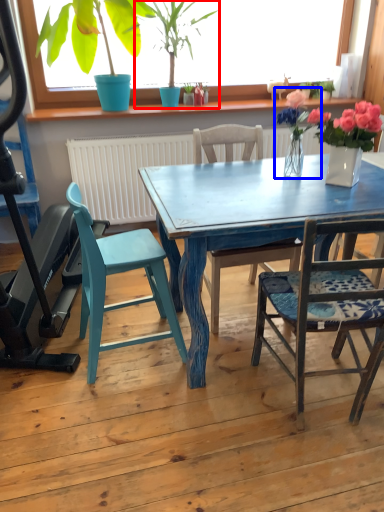
Question: Which point is further to the camera, houseplant (highlighted by a red box) or floral arrangement (highlighted by a blue box)?

Choices:
 (A) houseplant
 (B) floral arrangement

Answer: (A)